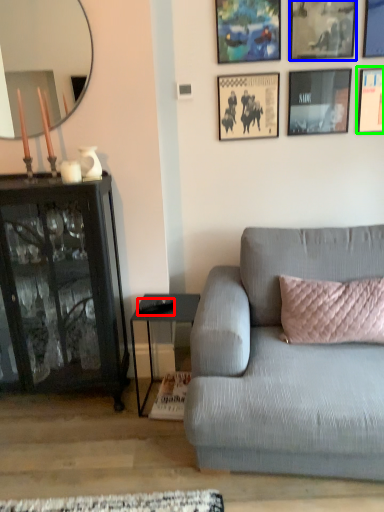
Question: Which object is the farthest from remote control (highlighted by a red box)? Choose among these: picture frame (highlighted by a blue box) or picture frame (highlighted by a green box).

Choices:
 (A) picture frame
 (B) picture frame

Answer: (A)